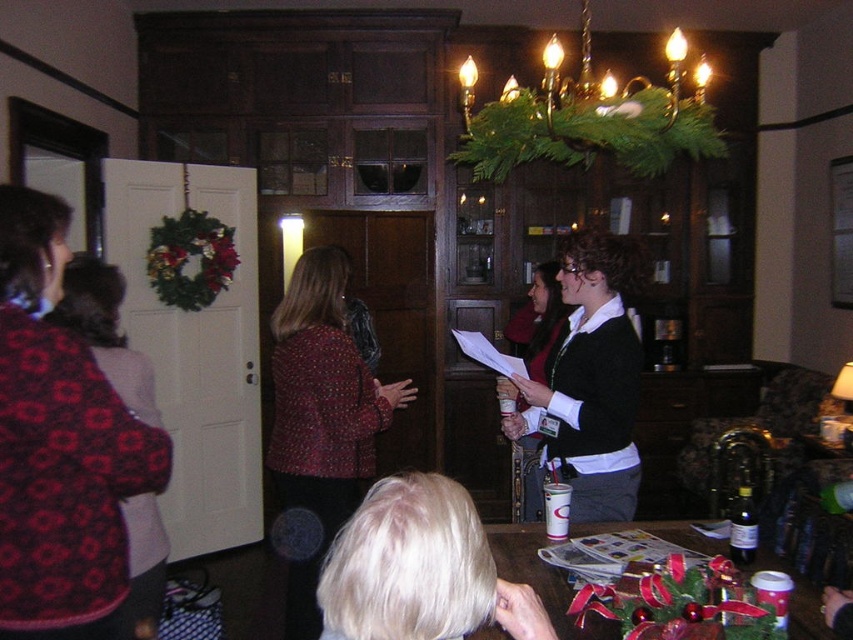
Question: Is red textured blazer at center wider than matte black sweater at center?

Choices:
 (A) yes
 (B) no

Answer: (A)

Question: Among these objects, which one is nearest to the camera?

Choices:
 (A) black sweater at center
 (B) red textured blazer at center
 (C) matte black sweater at center

Answer: (A)

Question: Which of the following is the farthest from the observer?

Choices:
 (A) matte black sweater at center
 (B) red textured blazer at center
 (C) red patterned sweater at left

Answer: (A)

Question: Does black sweater at center have a greater width compared to matte black sweater at center?

Choices:
 (A) no
 (B) yes

Answer: (A)

Question: Is black sweater at center closer to the viewer compared to red patterned sweater at left?

Choices:
 (A) yes
 (B) no

Answer: (B)

Question: Which object is positioned farthest from the matte black sweater at center?

Choices:
 (A) red patterned sweater at left
 (B) red textured blazer at center

Answer: (A)